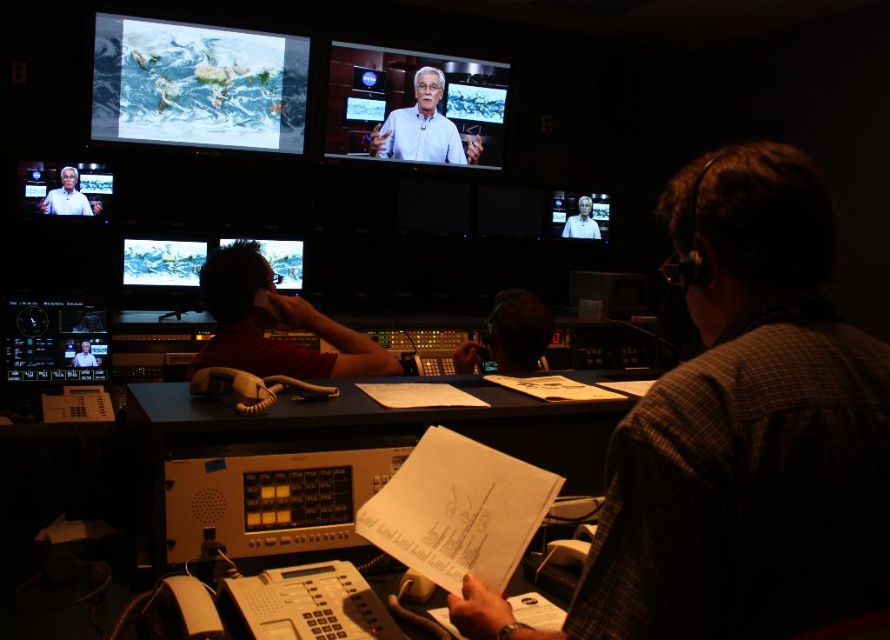
Question: In this image, where is white plastic table at center located relative to light blue shirt at upper center?

Choices:
 (A) right
 (B) left

Answer: (B)

Question: Which is farther from the white plastic table at center?

Choices:
 (A) light blue shirt at upper center
 (B) matte plastic monitor at center left
 (C) white shirt at upper center
 (D) plaid shirt at center

Answer: (A)

Question: Observing the image, what is the correct spatial positioning of dark red shirt at center in reference to dark gray headset at center?

Choices:
 (A) below
 (B) above

Answer: (B)

Question: Based on their relative distances, which object is nearer to the dark red shirt at center?

Choices:
 (A) white shirt at upper center
 (B) plaid shirt at center
 (C) matte white shirt at upper left
 (D) matte black monitor at lower left

Answer: (D)

Question: Which object appears closest to the camera in this image?

Choices:
 (A) white shirt at upper center
 (B) matte white shirt at upper left

Answer: (B)

Question: Is light blue fabric shirt at center to the right of matte black monitor at lower left from the viewer's perspective?

Choices:
 (A) no
 (B) yes

Answer: (B)